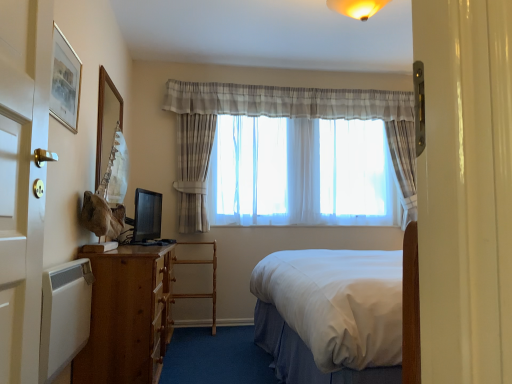
Question: In terms of height, does wooden ladder at center look taller or shorter compared to gold-framed picture at upper left, placed as the second picture frame when sorted from left to right?

Choices:
 (A) short
 (B) tall

Answer: (B)

Question: Considering the positions of point (181, 297) and point (65, 56), is point (181, 297) closer or farther from the camera than point (65, 56)?

Choices:
 (A) farther
 (B) closer

Answer: (A)

Question: Which is nearer to the gold-framed picture at upper left, the first picture frame when ordered from front to back?

Choices:
 (A) wooden ladder at center
 (B) white matte radiator at lower left
 (C) sheer fabric curtain at center
 (D) translucent fabric curtain at center
 (E) brown wooden desk at left

Answer: (B)

Question: Based on their relative distances, which object is nearer to the white matte radiator at lower left?

Choices:
 (A) brown wooden desk at left
 (B) translucent fabric curtain at center
 (C) wooden ladder at center
 (D) wooden picture frame at upper left, acting as the first picture frame starting from the back
 (E) gold-framed picture at upper left, which is the first picture frame from right to left

Answer: (A)